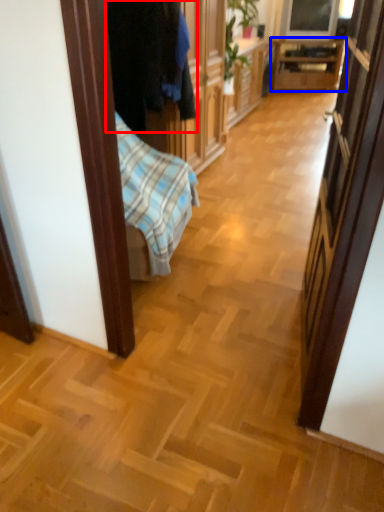
Question: Which point is closer to the camera, clothing (highlighted by a red box) or table (highlighted by a blue box)?

Choices:
 (A) clothing
 (B) table

Answer: (A)